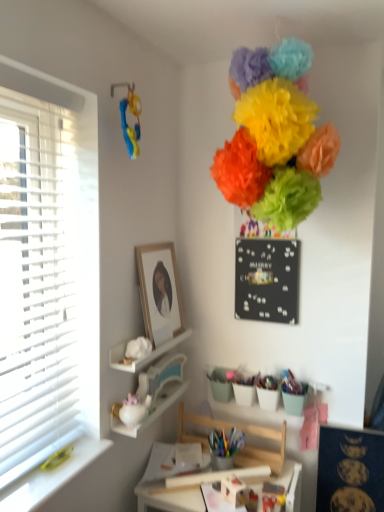
Question: Which direction should I rotate to look at black matte bulletin board at upper center, the 2th bulletin board when ordered from right to left?

Choices:
 (A) right
 (B) left

Answer: (A)

Question: Considering the relative sizes of wooden swivel chair at center and wooden framed portrait at upper center in the image provided, is wooden swivel chair at center bigger than wooden framed portrait at upper center?

Choices:
 (A) no
 (B) yes

Answer: (B)

Question: Would you consider wooden swivel chair at center to be distant from wooden framed portrait at upper center?

Choices:
 (A) yes
 (B) no

Answer: (B)

Question: Is wooden swivel chair at center thinner than wooden framed portrait at upper center?

Choices:
 (A) yes
 (B) no

Answer: (B)

Question: Considering the relative sizes of wooden swivel chair at center and wooden framed portrait at upper center in the image provided, is wooden swivel chair at center taller than wooden framed portrait at upper center?

Choices:
 (A) no
 (B) yes

Answer: (A)

Question: From the image's perspective, is wooden swivel chair at center located beneath wooden framed portrait at upper center?

Choices:
 (A) no
 (B) yes

Answer: (B)

Question: Considering the relative sizes of wooden swivel chair at center and wooden framed portrait at upper center in the image provided, is wooden swivel chair at center smaller than wooden framed portrait at upper center?

Choices:
 (A) yes
 (B) no

Answer: (B)

Question: Does matte paper pom-poms at upper center turn towards wooden framed portrait at upper center?

Choices:
 (A) yes
 (B) no

Answer: (B)

Question: From the image's perspective, is matte paper pom-poms at upper center above wooden framed portrait at upper center?

Choices:
 (A) yes
 (B) no

Answer: (A)

Question: Is matte paper pom-poms at upper center closer to camera compared to wooden framed portrait at upper center?

Choices:
 (A) yes
 (B) no

Answer: (A)

Question: Does matte paper pom-poms at upper center come behind wooden framed portrait at upper center?

Choices:
 (A) no
 (B) yes

Answer: (A)

Question: From the image's perspective, is matte paper pom-poms at upper center below wooden framed portrait at upper center?

Choices:
 (A) yes
 (B) no

Answer: (B)

Question: Is matte paper pom-poms at upper center thinner than wooden framed portrait at upper center?

Choices:
 (A) no
 (B) yes

Answer: (A)

Question: From the image's perspective, is white glossy teapot at lower left, marked as the 1th shelf in a bottom-to-top arrangement, on top of black matte bulletin board at upper center, the 2th bulletin board when ordered from right to left?

Choices:
 (A) yes
 (B) no

Answer: (B)